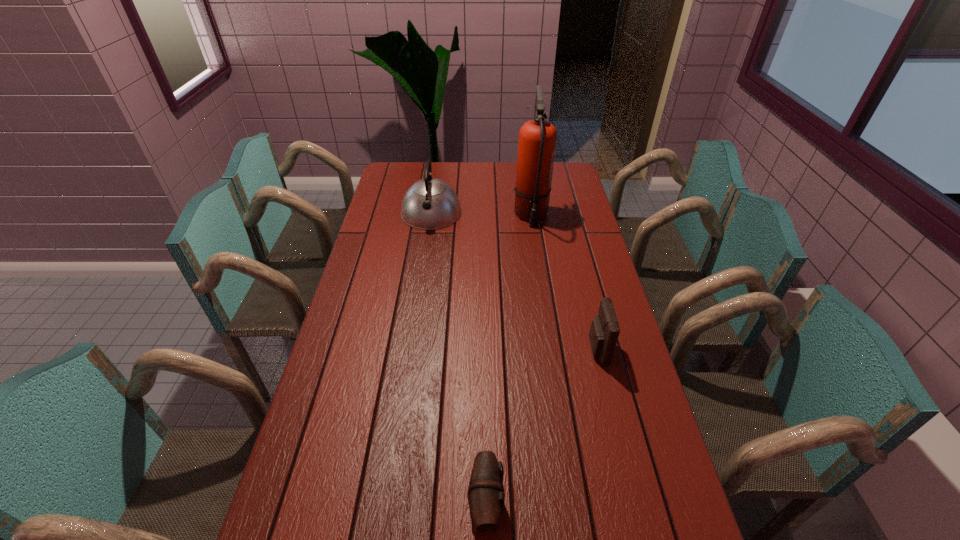
Locate an element on the screen. free space between the rightmost object and the second object from right to left is located at coordinates (564, 282).

The image size is (960, 540). In order to click on vacant region between the tallest object and the leftmost object in this screenshot , I will do `click(481, 214)`.

Locate an element on the screen. This screenshot has width=960, height=540. vacant region between the right pouch and the leftmost object is located at coordinates (515, 281).

Where is `free space between the tallest object and the farther pouch`? The height and width of the screenshot is (540, 960). free space between the tallest object and the farther pouch is located at coordinates (564, 282).

Identify which object is the second nearest to the tallest object. Please provide its 2D coordinates. Your answer should be formatted as a tuple, i.e. [(x, y)], where the tuple contains the x and y coordinates of a point satisfying the conditions above.

[(604, 331)]

Locate an element on the screen. The height and width of the screenshot is (540, 960). object identified as the second closest to the third object from left to right is located at coordinates (604, 331).